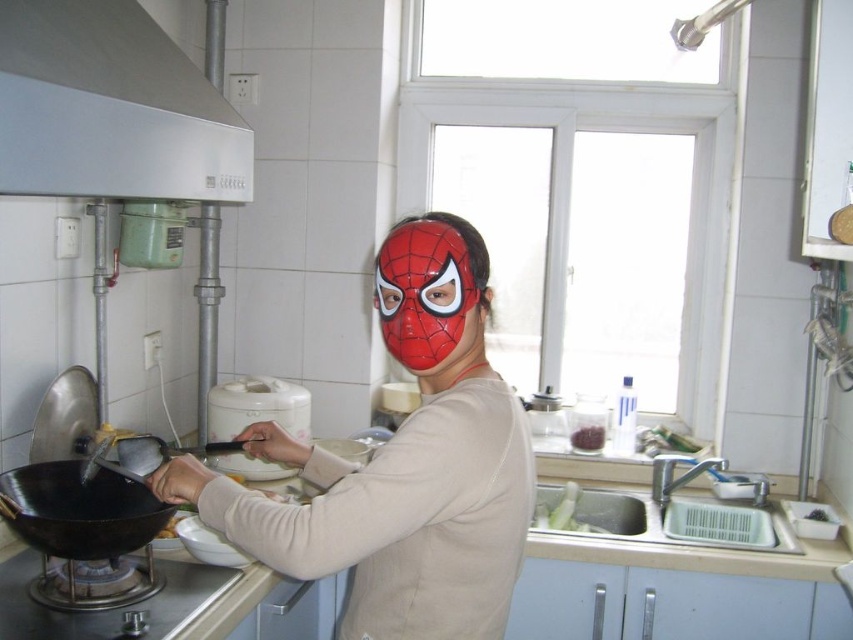
Locate an element on the screen. Image resolution: width=853 pixels, height=640 pixels. black matte wok at lower left is located at coordinates (80, 509).

Who is more distant from viewer, (88, 532) or (821, 513)?

The point (821, 513) is behind.

You are a GUI agent. You are given a task and a screenshot of the screen. Output one action in this format:
    pyautogui.click(x=<x>, y=<y>)
    Task: Click on the black matte wok at lower left
    The image size is (853, 640).
    Given the screenshot: What is the action you would take?
    pyautogui.click(x=80, y=509)

Describe the element at coordinates (403, 465) in the screenshot. I see `matte red mask at center` at that location.

Does matte red mask at center appear on the left side of black matte wok at lower left?

No, matte red mask at center is not to the left of black matte wok at lower left.

The height and width of the screenshot is (640, 853). Describe the element at coordinates (403, 465) in the screenshot. I see `matte red mask at center` at that location.

Where is `matte red mask at center`? matte red mask at center is located at coordinates (403, 465).

Who is more distant from viewer, (x=21, y=529) or (x=587, y=436)?

The point (x=587, y=436) is more distant.

Is black matte wok at lower left smaller than brown crumbly food at sink?

Incorrect, black matte wok at lower left is not smaller in size than brown crumbly food at sink.

You are a GUI agent. You are given a task and a screenshot of the screen. Output one action in this format:
    pyautogui.click(x=<x>, y=<y>)
    Task: Click on the black matte wok at lower left
    
    Given the screenshot: What is the action you would take?
    pyautogui.click(x=80, y=509)

You are a GUI agent. You are given a task and a screenshot of the screen. Output one action in this format:
    pyautogui.click(x=<x>, y=<y>)
    Task: Click on the black matte wok at lower left
    
    Given the screenshot: What is the action you would take?
    pyautogui.click(x=80, y=509)